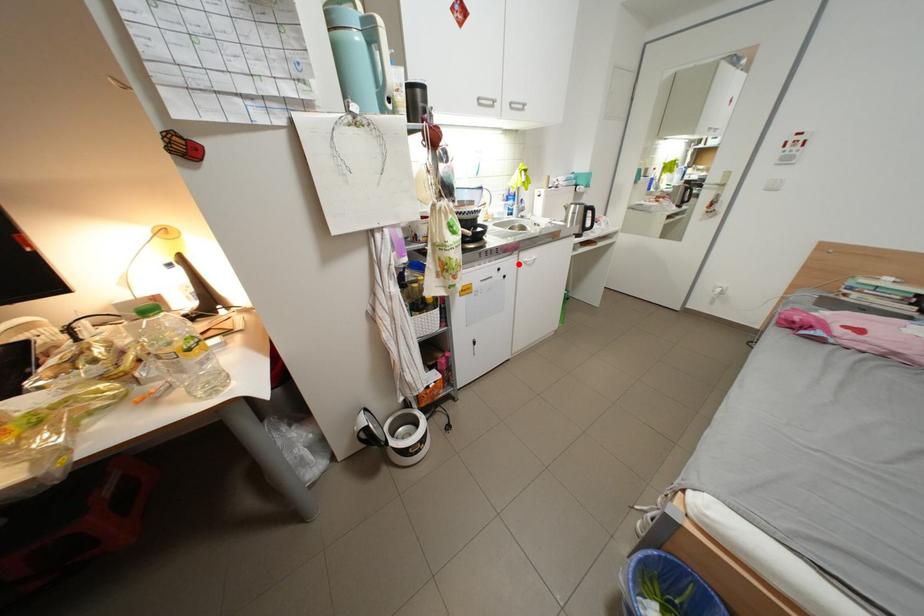
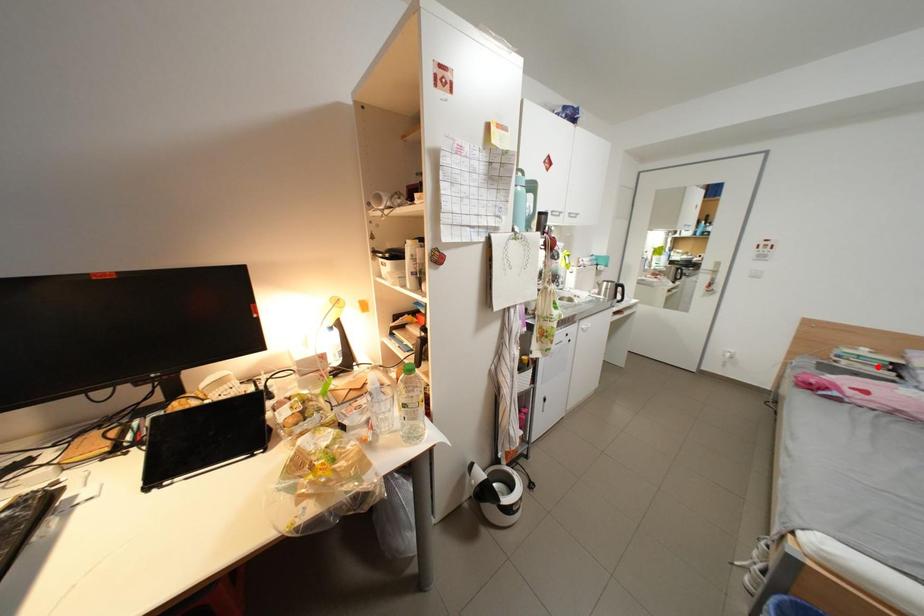
I am providing you with two images of the same scene from different viewpoints. A red point is marked on the first image and another point is marked on the second image. Does the point marked in image1 correspond to the same location as the one in image2?

No